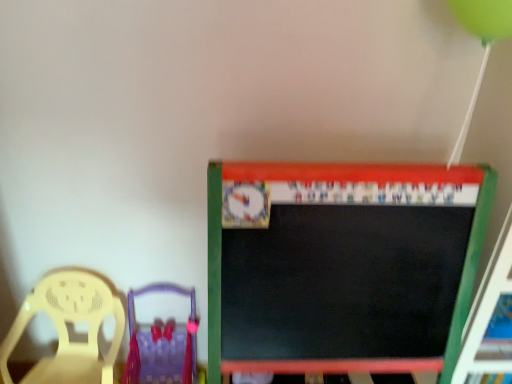
Question: Does purple fabric chair at lower left, the 2th chair when ordered from left to right, lie behind matte yellow chair at left, arranged as the 2th chair when viewed from the right?

Choices:
 (A) no
 (B) yes

Answer: (B)

Question: Is purple fabric chair at lower left, the first chair positioned from the right, turned away from matte yellow chair at left, arranged as the 2th chair when viewed from the right?

Choices:
 (A) no
 (B) yes

Answer: (A)

Question: From a real-world perspective, does purple fabric chair at lower left, the 2th chair when ordered from left to right, sit lower than matte yellow chair at left, arranged as the 2th chair when viewed from the right?

Choices:
 (A) yes
 (B) no

Answer: (A)

Question: From the image's perspective, does purple fabric chair at lower left, the 2th chair when ordered from left to right, appear lower than matte yellow chair at left, which is the 1th chair in left-to-right order?

Choices:
 (A) no
 (B) yes

Answer: (B)

Question: Does purple fabric chair at lower left, the first chair positioned from the right, have a greater height compared to matte yellow chair at left, which is the 1th chair in left-to-right order?

Choices:
 (A) yes
 (B) no

Answer: (B)

Question: Does purple fabric chair at lower left, the first chair positioned from the right, have a larger size compared to matte yellow chair at left, arranged as the 2th chair when viewed from the right?

Choices:
 (A) no
 (B) yes

Answer: (A)

Question: From a real-world perspective, is matte yellow chair at left, which is the 1th chair in left-to-right order, below purple fabric chair at lower left, the first chair positioned from the right?

Choices:
 (A) no
 (B) yes

Answer: (A)

Question: From the image's perspective, is matte yellow chair at left, arranged as the 2th chair when viewed from the right, below purple fabric chair at lower left, the first chair positioned from the right?

Choices:
 (A) no
 (B) yes

Answer: (A)

Question: From a real-world perspective, does matte yellow chair at left, arranged as the 2th chair when viewed from the right, stand above purple fabric chair at lower left, the 2th chair when ordered from left to right?

Choices:
 (A) yes
 (B) no

Answer: (A)

Question: Is matte yellow chair at left, arranged as the 2th chair when viewed from the right, turned away from purple fabric chair at lower left, the 2th chair when ordered from left to right?

Choices:
 (A) no
 (B) yes

Answer: (A)

Question: Can you confirm if matte yellow chair at left, arranged as the 2th chair when viewed from the right, is taller than purple fabric chair at lower left, the 2th chair when ordered from left to right?

Choices:
 (A) no
 (B) yes

Answer: (B)

Question: Is matte yellow chair at left, arranged as the 2th chair when viewed from the right, outside of purple fabric chair at lower left, the 2th chair when ordered from left to right?

Choices:
 (A) yes
 (B) no

Answer: (A)

Question: Would you say purple fabric chair at lower left, the first chair positioned from the right, is inside or outside matte yellow chair at left, arranged as the 2th chair when viewed from the right?

Choices:
 (A) inside
 (B) outside

Answer: (B)